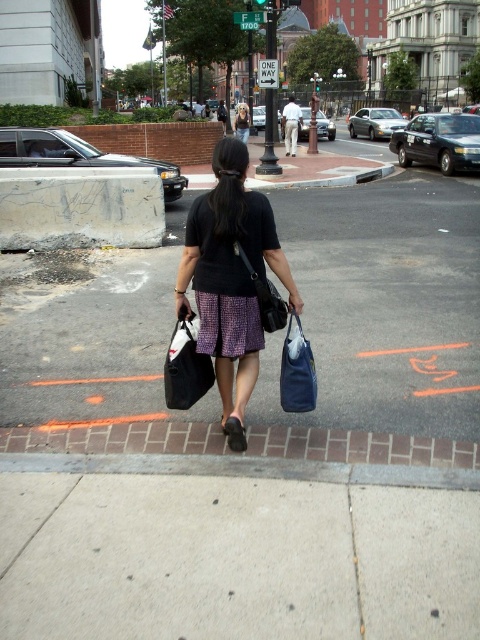
Question: Which point is closer to the camera?

Choices:
 (A) patterned fabric dress at center
 (B) matte blue fabric bag at lower center

Answer: (B)

Question: Which of the following is the closest to the observer?

Choices:
 (A) (252, 186)
 (B) (251, 326)

Answer: (B)

Question: Does gray concrete sidewalk at lower center have a smaller size compared to brick at lower center?

Choices:
 (A) yes
 (B) no

Answer: (B)

Question: Among these objects, which one is farthest from the camera?

Choices:
 (A) leather textured handbag at center
 (B) gray concrete sidewalk at lower center
 (C) matte blue fabric bag at lower center
 (D) smooth asphalt road at center

Answer: (D)

Question: Is patterned fabric dress at center further to the viewer compared to matte black bag at center?

Choices:
 (A) yes
 (B) no

Answer: (A)

Question: In this image, where is matte blue fabric bag at lower center located relative to leather textured handbag at center?

Choices:
 (A) below
 (B) above

Answer: (A)